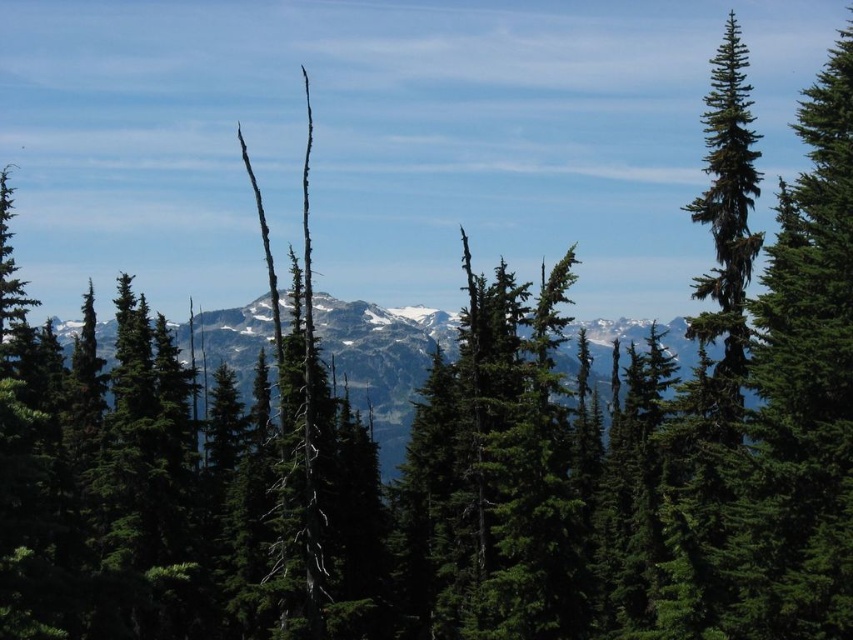
Is green needle-like tree at center behind green textured mountain range at center?

That is False.

Who is more distant from viewer, (527, 486) or (410, 316)?

The point (410, 316) is behind.

Where is `green needle-like tree at center`? The width and height of the screenshot is (853, 640). green needle-like tree at center is located at coordinates (498, 472).